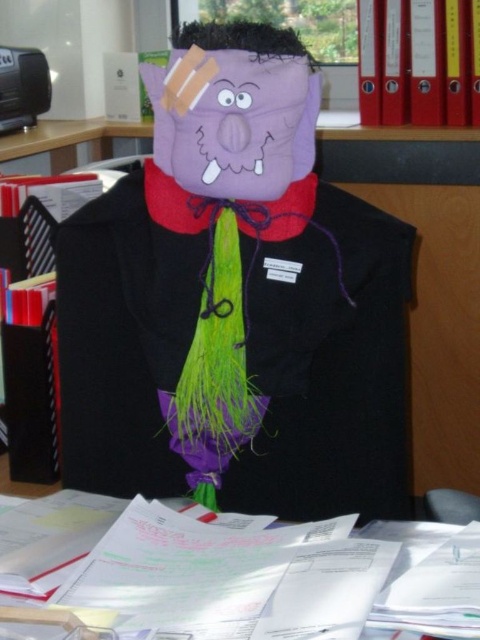
Question: Does matte purple mask at center have a lesser width compared to white paper at lower center?

Choices:
 (A) yes
 (B) no

Answer: (A)

Question: Is matte purple mask at center above white paper at lower center?

Choices:
 (A) yes
 (B) no

Answer: (A)

Question: Estimate the real-world distances between objects in this image. Which object is farther from the matte purple mask at center?

Choices:
 (A) purple felt mask at center
 (B) white paper at lower center

Answer: (B)

Question: Among these objects, which one is farthest from the camera?

Choices:
 (A) white paper at lower center
 (B) purple felt mask at center
 (C) matte purple mask at center

Answer: (B)

Question: Can you confirm if matte purple mask at center is thinner than white paper at lower center?

Choices:
 (A) no
 (B) yes

Answer: (B)

Question: Among these points, which one is nearest to the camera?

Choices:
 (A) (216, 77)
 (B) (215, 68)
 (C) (144, 627)

Answer: (C)